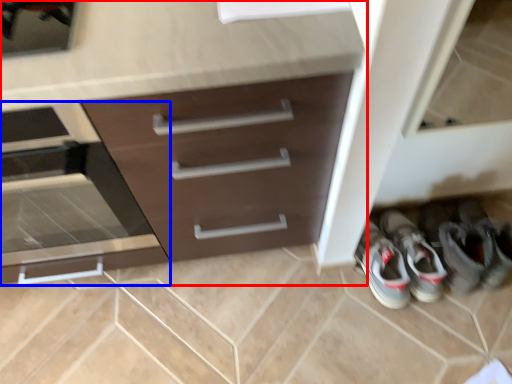
Question: Which object appears farthest to the camera in this image, chest of drawers (highlighted by a red box) or drawer (highlighted by a blue box)?

Choices:
 (A) chest of drawers
 (B) drawer

Answer: (B)